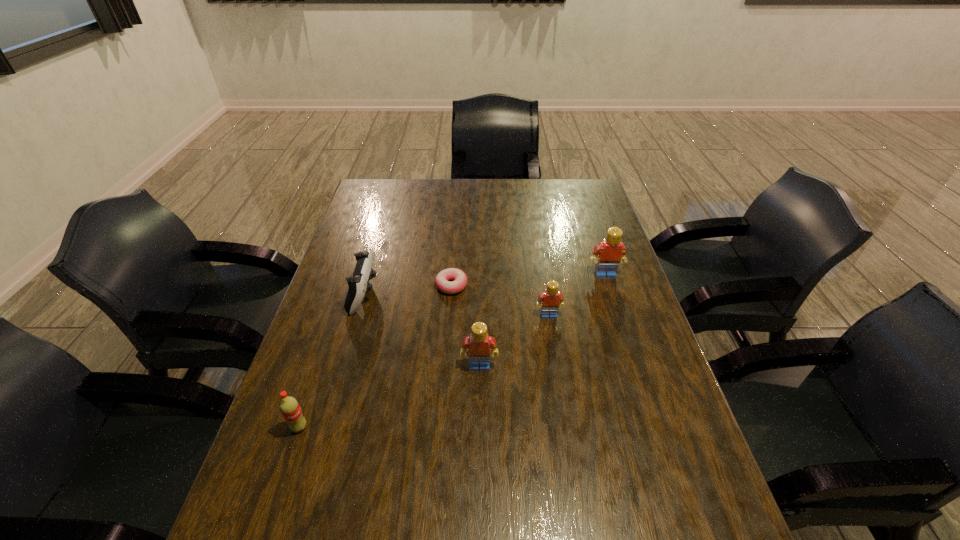
Where is `vacant space located 0.320m on the front-facing side of the fifth farthest object`? vacant space located 0.320m on the front-facing side of the fifth farthest object is located at coordinates (479, 508).

Locate an element on the screen. vacant space located 0.200m on the front-facing side of the second object from right to left is located at coordinates (559, 380).

Where is `vacant area located 0.080m on the front-facing side of the rightmost object`? vacant area located 0.080m on the front-facing side of the rightmost object is located at coordinates (612, 298).

Locate an element on the screen. free space located 0.270m on the front-facing side of the control is located at coordinates (468, 295).

Where is `vacant area situated 0.160m on the right of the shortest object`? The height and width of the screenshot is (540, 960). vacant area situated 0.160m on the right of the shortest object is located at coordinates (520, 285).

Locate an element on the screen. free space located 0.060m on the right of the nearest object is located at coordinates (335, 427).

The width and height of the screenshot is (960, 540). What are the coordinates of `control located at the left edge` in the screenshot? It's located at (358, 283).

Where is `soda located at the left edge`? The image size is (960, 540). soda located at the left edge is located at coordinates (289, 407).

You are a GUI agent. You are given a task and a screenshot of the screen. Output one action in this format:
    pyautogui.click(x=<x>, y=<y>)
    Task: Click on the object that is at the right edge
    
    Given the screenshot: What is the action you would take?
    [x=611, y=251]

In the image, there is a desktop. Where is `vacant region at the far edge`? The image size is (960, 540). vacant region at the far edge is located at coordinates (517, 210).